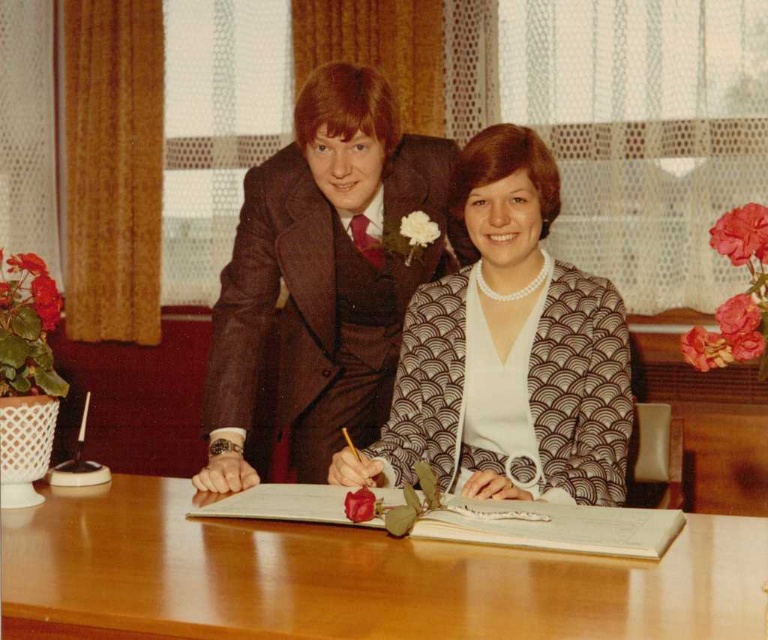
Question: Which point is closer to the camera taking this photo?

Choices:
 (A) (326, 372)
 (B) (55, 531)

Answer: (B)

Question: Is wooden table at center behind brown textured blazer at center?

Choices:
 (A) no
 (B) yes

Answer: (A)

Question: Does brown textured suit at center appear over brown textured blazer at center?

Choices:
 (A) no
 (B) yes

Answer: (B)

Question: Is wooden table at center to the right of brown textured suit at center from the viewer's perspective?

Choices:
 (A) yes
 (B) no

Answer: (A)

Question: Which point is farther to the camera?

Choices:
 (A) (217, 492)
 (B) (611, 476)
 (C) (282, 568)

Answer: (A)

Question: Which of the following is the farthest from the observer?

Choices:
 (A) brown textured suit at center
 (B) wooden table at center

Answer: (A)